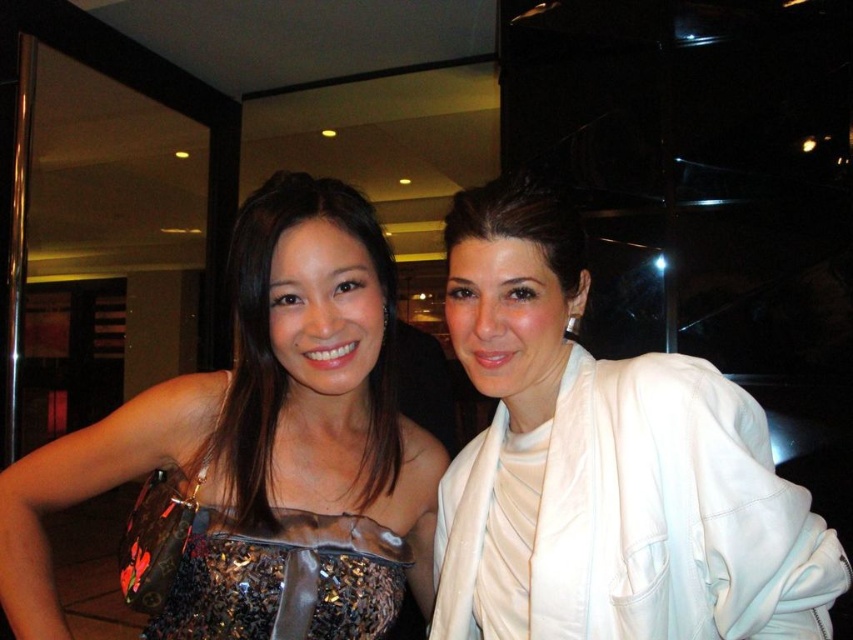
You are a photographer at a fashion show. You need to capture a shot where the white satin robe at right is visible above the sparkly sequined dress at lower left. Is this possible based on their positions in the image?

Yes, the white satin robe at right is positioned above the sparkly sequined dress at lower left, so capturing such a shot is possible.

You are a photographer at a fashion event. You need to capture both the sequined fabric dress at center and the shiny sequined dress at center in a single frame. Which dress should you focus on to ensure both are fully visible without cropping?

You should focus on the shiny sequined dress at center because the sequined fabric dress at center is wider, so positioning the narrower shiny sequined dress at center closer to the center of the frame will allow both to fit without cropping.

You are standing in front of the image and want to know which point is nearer to you. Which one is closer between point (753,637) and point (280,556)?

Result: Point (753,637) is closer to the viewer than point (280,556).